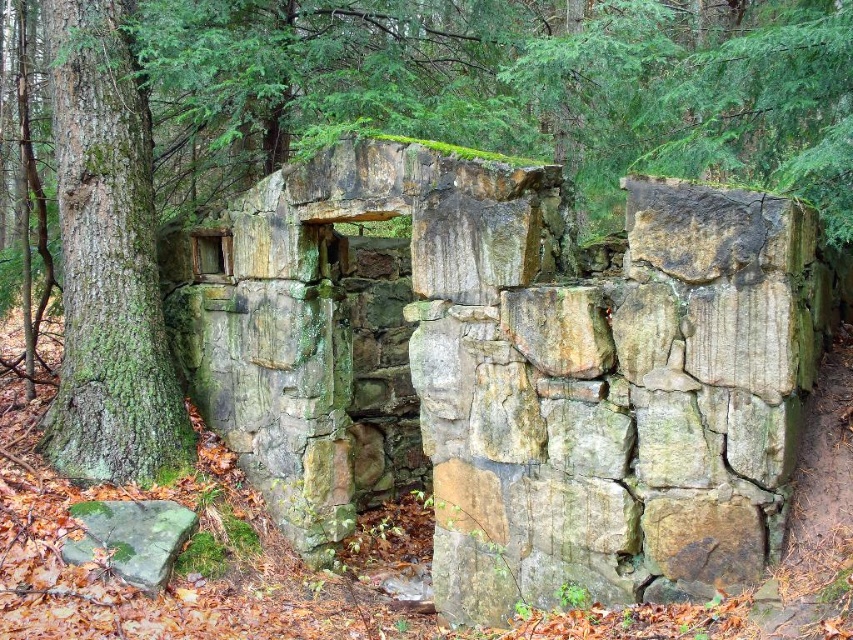
Question: Which object appears farthest from the camera in this image?

Choices:
 (A) green mossy bark tree at left
 (B) green mossy rock at lower left

Answer: (A)

Question: Can you confirm if green mossy stone wall at center is thinner than green mossy bark tree at left?

Choices:
 (A) no
 (B) yes

Answer: (A)

Question: Is green mossy stone wall at center thinner than green mossy bark tree at left?

Choices:
 (A) yes
 (B) no

Answer: (B)

Question: Which of the following is the closest to the observer?

Choices:
 (A) (84, 337)
 (B) (567, 428)

Answer: (B)

Question: Can you confirm if green mossy stone wall at center is positioned to the right of green mossy rock at lower left?

Choices:
 (A) no
 (B) yes

Answer: (B)

Question: Among these objects, which one is nearest to the camera?

Choices:
 (A) green mossy bark tree at left
 (B) green mossy stone wall at center
 (C) green mossy rock at lower left

Answer: (B)